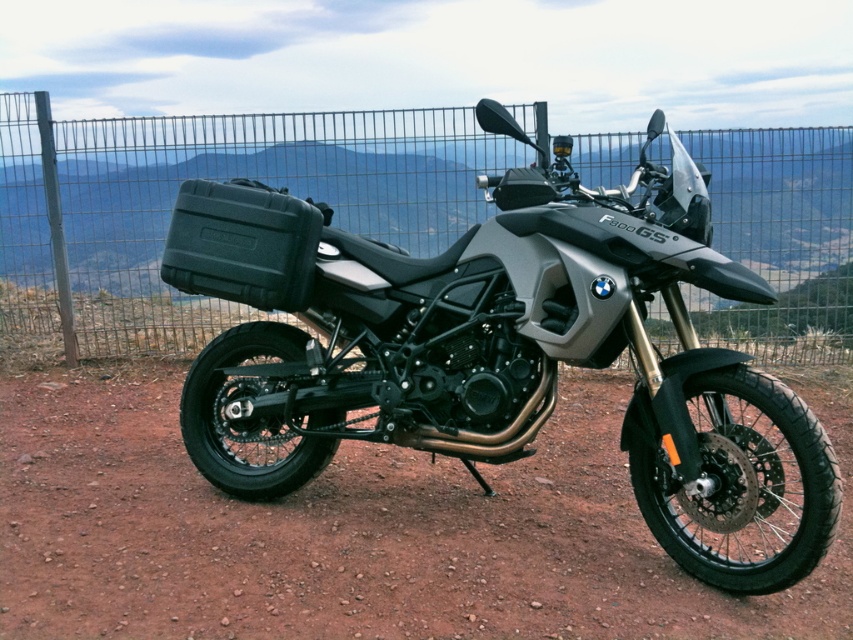
Identify the location of matte black motorcycle at center. (503, 349).

Is matte black motorcycle at center below metallic wire fence at upper center?

Indeed, matte black motorcycle at center is positioned under metallic wire fence at upper center.

Between point (524, 451) and point (787, 244), which one is positioned behind?

The point (787, 244) is more distant.

Find the location of a particular element. matte black motorcycle at center is located at coordinates (503, 349).

Which of these two, brown gravel dirt track at center or metallic wire fence at upper center, stands shorter?

With less height is metallic wire fence at upper center.

Is brown gravel dirt track at center taller than metallic wire fence at upper center?

Yes.

Which is in front, point (837, 589) or point (209, 147)?

Point (837, 589) is more forward.

You are a GUI agent. You are given a task and a screenshot of the screen. Output one action in this format:
    pyautogui.click(x=<x>, y=<y>)
    Task: Click on the brown gravel dirt track at center
    The height and width of the screenshot is (640, 853).
    Given the screenshot: What is the action you would take?
    pyautogui.click(x=358, y=531)

Can you confirm if matte black motorcycle at center is taller than brown gravel dirt track at center?

Yes.

Does point (682, 195) lie in front of point (86, 378)?

That is True.

Which is behind, point (791, 422) or point (592, 426)?

Point (592, 426)

What are the coordinates of `matte black motorcycle at center` in the screenshot? It's located at (503, 349).